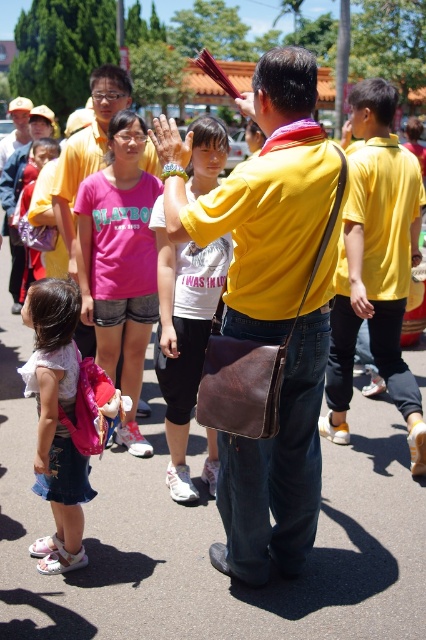
You are a photographer at the event and want to ensure both the matte yellow shirt at center and the yellow matte shirt at center are clearly visible in your photo. Which shirt should you focus on to capture the details of the smaller one?

The matte yellow shirt at center is smaller than the yellow matte shirt at center, so you should focus on the matte yellow shirt at center to capture the details of the smaller one.

You are a photographer trying to capture the entire scene in one shot. The matte yellow shirt at center and the matte pink backpack at lower left are both in your frame. Considering their sizes, which object should you focus on to ensure both are clearly visible?

The matte yellow shirt at center is bigger than the matte pink backpack at lower left, so focusing on the matte yellow shirt at center would help ensure both objects are clearly visible as it takes up more space in the frame.